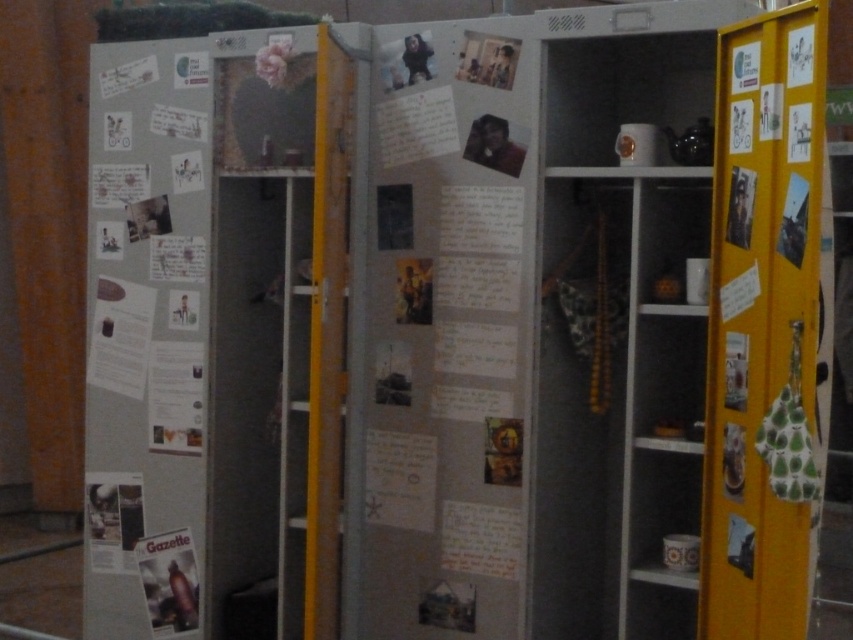
You are a delivery person who needs to place a rectangular package that is 12 inches long between the matte paper poster at left and the matte paper gazette at lower left on the wardrobe door. Is there enough space to fit the package horizontally between them?

The distance between the matte paper poster at left and the matte paper gazette at lower left is 11.50 inches. Since the package is 12 inches long, it is slightly longer than the available space. Therefore, the package cannot fit horizontally between them.

You are standing in front of the wardrobe and want to reach both the point at coordinates [96,586] and the point at coordinates [728,272]. Which point should you reach first if you want to touch them in the order they appear from closest to farthest from you?

You should reach the point at coordinates [728,272] first because it is closer to you than the point at coordinates [96,586], which is behind it.

You are standing in the room and want to take a photo of the matte paper poster at left. You have a camera that requires you to be at least 10 feet away to avoid distortion. Is the camera positioned correctly to take the photo without distortion?

The matte paper poster at left and camera are 9.82 feet apart from each other. Since the minimum required distance is 10 feet, the camera is too close to avoid distortion. Move back to ensure proper distance.